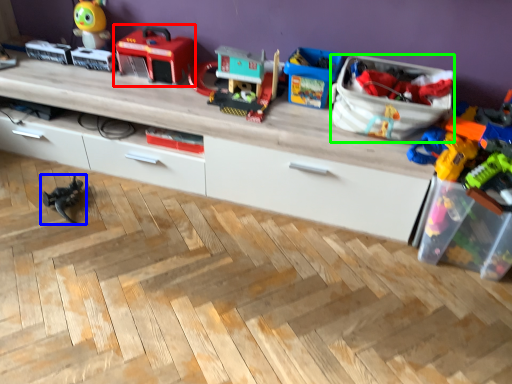
Question: Estimate the real-world distances between objects in this image. Which object is closer to toy (highlighted by a red box), toy (highlighted by a blue box) or storage box (highlighted by a green box)?

Choices:
 (A) toy
 (B) storage box

Answer: (A)